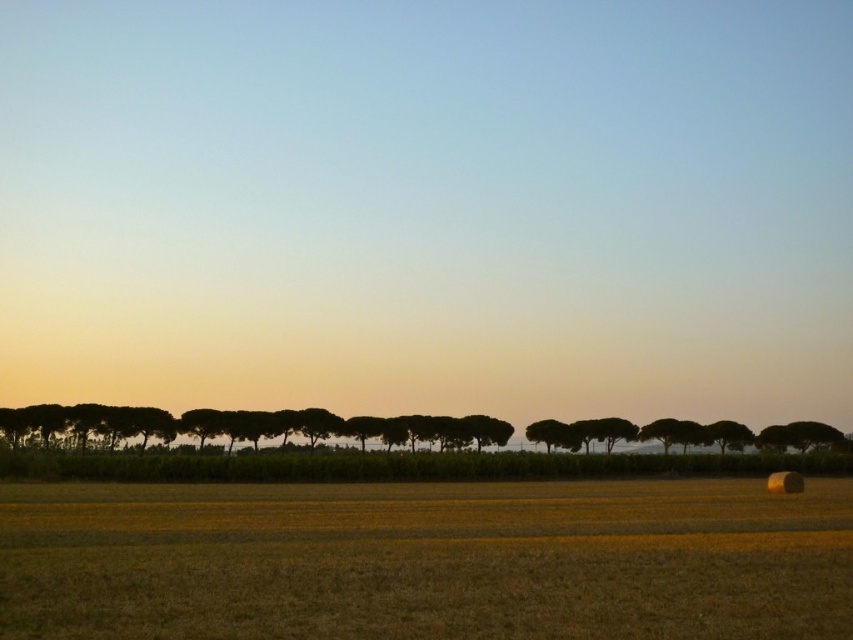
Question: Can you confirm if yellow grass at lower center is positioned above silhouette/leafy trees at center?

Choices:
 (A) no
 (B) yes

Answer: (B)

Question: Which object is the closest to the yellow grass at lower center?

Choices:
 (A) silhouette/leafy trees at center
 (B) silhouette/transparent tree at center

Answer: (A)

Question: Among these objects, which one is farthest from the camera?

Choices:
 (A) yellow grass at lower center
 (B) silhouette/leafy trees at center
 (C) silhouette/transparent tree at center

Answer: (C)

Question: Does yellow grass at lower center appear over silhouette/transparent tree at center?

Choices:
 (A) no
 (B) yes

Answer: (B)

Question: Considering the relative positions of yellow grass at lower center and silhouette/transparent tree at center in the image provided, where is yellow grass at lower center located with respect to silhouette/transparent tree at center?

Choices:
 (A) right
 (B) left

Answer: (B)

Question: Which point is farther from the camera taking this photo?

Choices:
 (A) (788, 577)
 (B) (561, 435)
 (C) (247, 428)

Answer: (B)